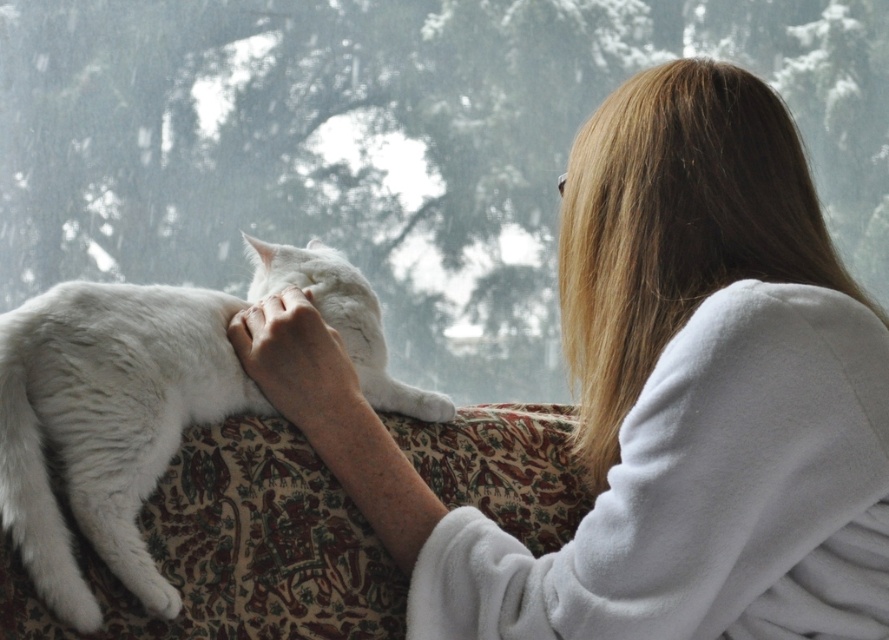
You are a tailor measuring fabrics for a new project. You have a piece of fabric that is exactly the same width as the white fluffy cat at center. Can you use this fabric to make a new robe that will fit the white fluffy robe at upper right?

The white fluffy robe at upper right is wider than the white fluffy cat at center. Since your fabric matches the cat, it won not be wide enough to make a robe as wide as the one at upper right.